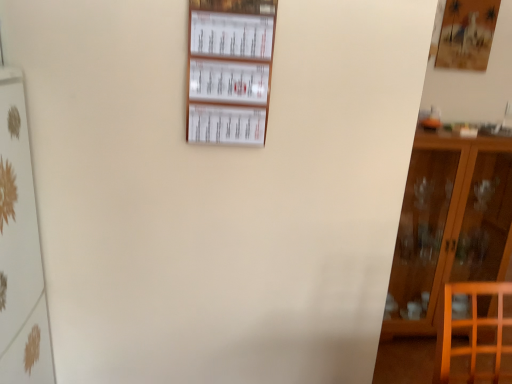
Question: Which direction should I rotate to face white paperboard at upper center, positioned as the 1th shelf in right-to-left order, — up or down?

Choices:
 (A) up
 (B) down

Answer: (A)

Question: Considering the relative positions of brown wooden cabinet at right and white paperboard at upper center, positioned as the 1th shelf in right-to-left order, in the image provided, is brown wooden cabinet at right to the left of white paperboard at upper center, positioned as the 1th shelf in right-to-left order, from the viewer's perspective?

Choices:
 (A) yes
 (B) no

Answer: (B)

Question: Considering the relative sizes of brown wooden cabinet at right and white paperboard at upper center, positioned as the 1th shelf in right-to-left order, in the image provided, is brown wooden cabinet at right taller than white paperboard at upper center, positioned as the 1th shelf in right-to-left order,?

Choices:
 (A) no
 (B) yes

Answer: (B)

Question: From a real-world perspective, does brown wooden cabinet at right sit lower than white paperboard at upper center, positioned as the 2th shelf in bottom-to-top order?

Choices:
 (A) yes
 (B) no

Answer: (A)

Question: From the image's perspective, is brown wooden cabinet at right under white paperboard at upper center, which is the 1th shelf from top to bottom?

Choices:
 (A) no
 (B) yes

Answer: (B)

Question: Is brown wooden cabinet at right positioned before white paperboard at upper center, positioned as the 1th shelf in right-to-left order?

Choices:
 (A) no
 (B) yes

Answer: (A)

Question: Is brown wooden cabinet at right not near white paperboard at upper center, which is the 1th shelf from top to bottom?

Choices:
 (A) no
 (B) yes

Answer: (B)

Question: From the image's perspective, is white glossy shelf at left, which is counted as the first shelf, starting from the left, beneath brown wooden cabinet at right?

Choices:
 (A) no
 (B) yes

Answer: (B)

Question: Is white glossy shelf at left, placed as the 2th shelf when sorted from right to left, wider than brown wooden cabinet at right?

Choices:
 (A) no
 (B) yes

Answer: (A)

Question: Is white glossy shelf at left, which is the second shelf in top-to-bottom order, closer to camera compared to brown wooden cabinet at right?

Choices:
 (A) no
 (B) yes

Answer: (B)

Question: Does white glossy shelf at left, which is counted as the first shelf, starting from the left, appear on the right side of brown wooden cabinet at right?

Choices:
 (A) yes
 (B) no

Answer: (B)

Question: Is white glossy shelf at left, which is the second shelf in top-to-bottom order, oriented away from brown wooden cabinet at right?

Choices:
 (A) yes
 (B) no

Answer: (B)

Question: Is brown wooden cabinet at right located within white glossy shelf at left, placed as the 2th shelf when sorted from right to left?

Choices:
 (A) yes
 (B) no

Answer: (B)

Question: From the image's perspective, would you say white paperboard at upper center, positioned as the 1th shelf in right-to-left order, is shown under white glossy shelf at left, placed as the 2th shelf when sorted from right to left?

Choices:
 (A) yes
 (B) no

Answer: (B)